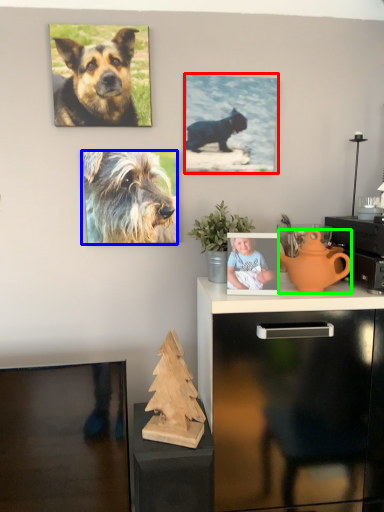
Question: Which object is the closest to the picture frame (highlighted by a red box)? Choose among these: dog (highlighted by a blue box) or teapot (highlighted by a green box).

Choices:
 (A) dog
 (B) teapot

Answer: (A)